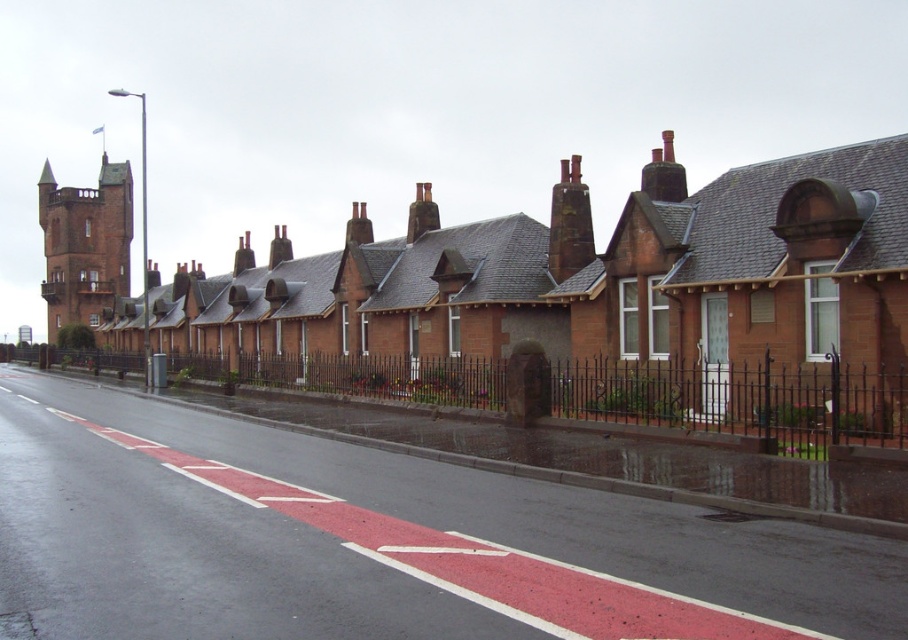
Between matte brick church at center and rusty metal chimney at center, which one is positioned higher?

matte brick church at center is above.

You are a GUI agent. You are given a task and a screenshot of the screen. Output one action in this format:
    pyautogui.click(x=<x>, y=<y>)
    Task: Click on the matte brick church at center
    The width and height of the screenshot is (908, 640).
    Given the screenshot: What is the action you would take?
    pyautogui.click(x=596, y=280)

Does red asphalt road at center have a greater height compared to matte brick church at center?

No, red asphalt road at center is not taller than matte brick church at center.

The height and width of the screenshot is (640, 908). What do you see at coordinates (324, 540) in the screenshot?
I see `red asphalt road at center` at bounding box center [324, 540].

I want to click on red asphalt road at center, so tap(324, 540).

Which is above, red asphalt road at center or rusty metal chimney at center?

rusty metal chimney at center is above.

Where is `red asphalt road at center`? red asphalt road at center is located at coordinates (324, 540).

Between point (413, 486) and point (579, 172), which one is positioned in front?

Point (413, 486) is more forward.

Locate an element on the screen. This screenshot has height=640, width=908. red asphalt road at center is located at coordinates (324, 540).